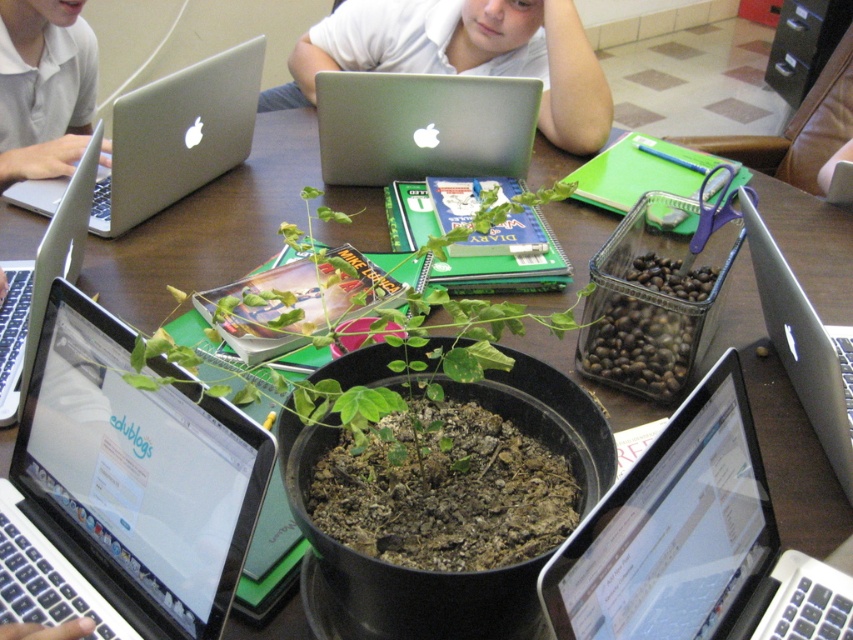
You are a student who wants to place a 15 cm tall textbook between the silver metallic laptop at lower right and the silver metallic laptop at right. Can you fit it vertically between them?

The silver metallic laptop at lower right is shorter than the silver metallic laptop at right, so there might be enough vertical space between them. However, the exact height difference isn not specified, so it is uncertain if the 15 cm tall textbook will fit vertically between them.

You are a student who wants to place a 20 cm wide textbook between the silver metallic laptop at upper left and the white matte shirt at upper left. Can the textbook fit in the space between them?

The distance between the silver metallic laptop at upper left and the white matte shirt at upper left is 23.12 centimeters. Since the textbook is 20 cm wide, it can fit in the space between them as there is enough room.

You are a student sitting at the table and need to reach for your silver metallic laptop at lower right. Considering the coordinates provided in the Objects Description, can you estimate its position relative to the black pot with the green leaves?

The silver metallic laptop at lower right is located at coordinates point (693, 541), which places it in the lower right area of the table, further away from the black pot with the green leaves at the center.